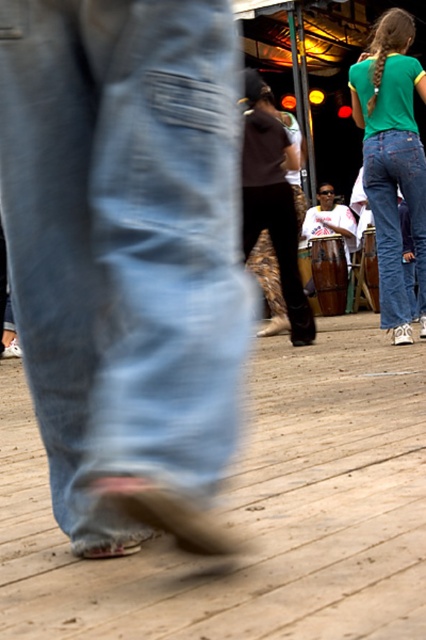
Question: Which point is farther to the camera?

Choices:
 (A) camouflage pants at center
 (B) white matte drum at center
 (C) denim jeans at upper right

Answer: (B)

Question: Is camouflage pants at center bigger than denim jeans at upper right?

Choices:
 (A) no
 (B) yes

Answer: (B)

Question: Is denim jeans at lower left positioned behind white matte drum at center?

Choices:
 (A) no
 (B) yes

Answer: (A)

Question: Is green denim jeans at upper right to the right of camouflage pants at center from the viewer's perspective?

Choices:
 (A) no
 (B) yes

Answer: (B)

Question: Considering the real-world distances, which object is farthest from the denim jeans at upper right?

Choices:
 (A) camouflage pants at center
 (B) denim jeans at lower left

Answer: (B)

Question: Estimate the real-world distances between objects in this image. Which object is closer to the denim jeans at lower left?

Choices:
 (A) green denim jeans at upper right
 (B) camouflage pants at center
 (C) denim jeans at upper right

Answer: (C)